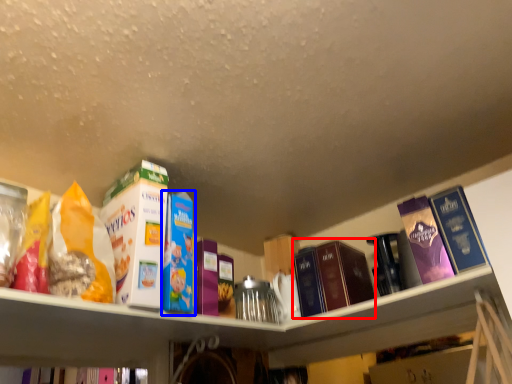
Question: Which of the following is the farthest to the observer, book (highlighted by a red box) or book (highlighted by a blue box)?

Choices:
 (A) book
 (B) book

Answer: (A)